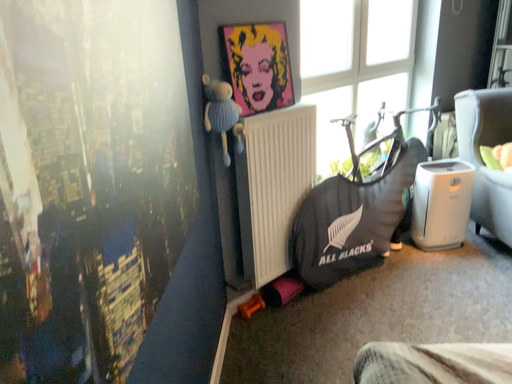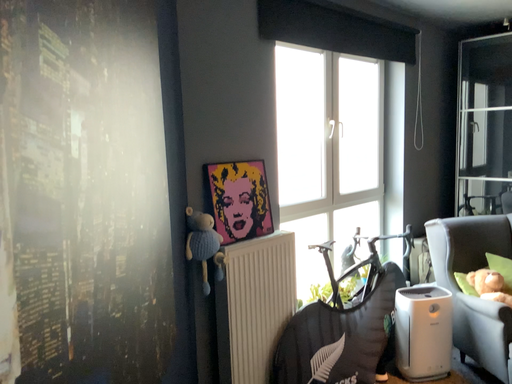
Question: How did the camera likely rotate when shooting the video?

Choices:
 (A) rotated upward
 (B) rotated downward

Answer: (A)